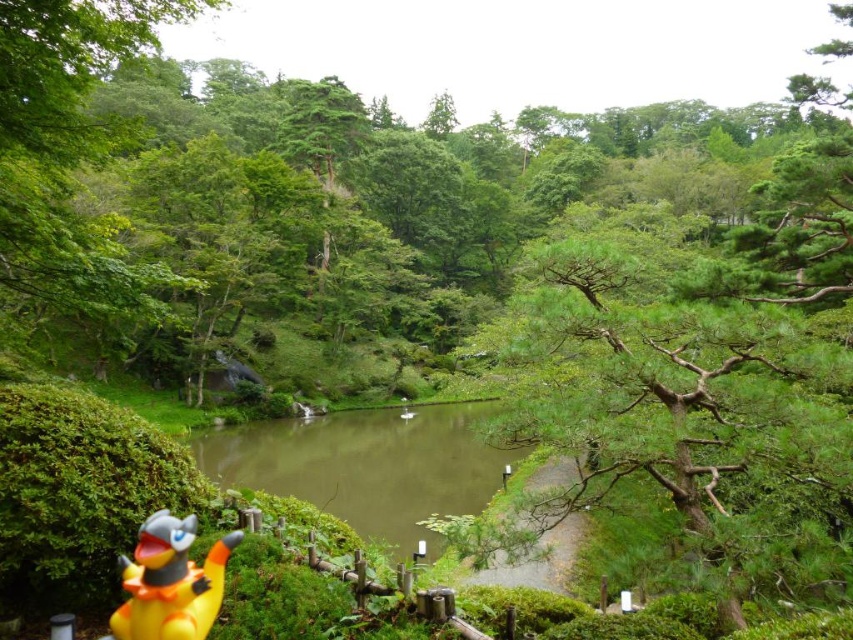
You are a photographer trying to capture the yellow rubber duck at lower left and the green murky water at center in a single shot. Based on their positions, which object should you focus on first to ensure both are in frame?

The yellow rubber duck at lower left should be focused on first since the green murky water at center is positioned under it, ensuring both will be captured when centered on the duck.

You are a photographer standing at the edge of the pond. You want to take a clear photo of the yellow rubber duck at lower left without the green murky water at center blocking the view. Is this possible?

The yellow rubber duck at lower left is behind the green murky water at center, so taking a clear photo of the yellow rubber duck at lower left without the green murky water at center blocking the view is not possible.

You are a small toy boat that is 1 meter long. You want to sail from the yellow rubber duck at lower left to the green murky water at center. Is there enough space for your boat to move freely between them?

The distance between the yellow rubber duck at lower left and the green murky water at center is 21.84 meters. Since your boat is only 1 meter long, there is more than enough space for it to move freely between them.